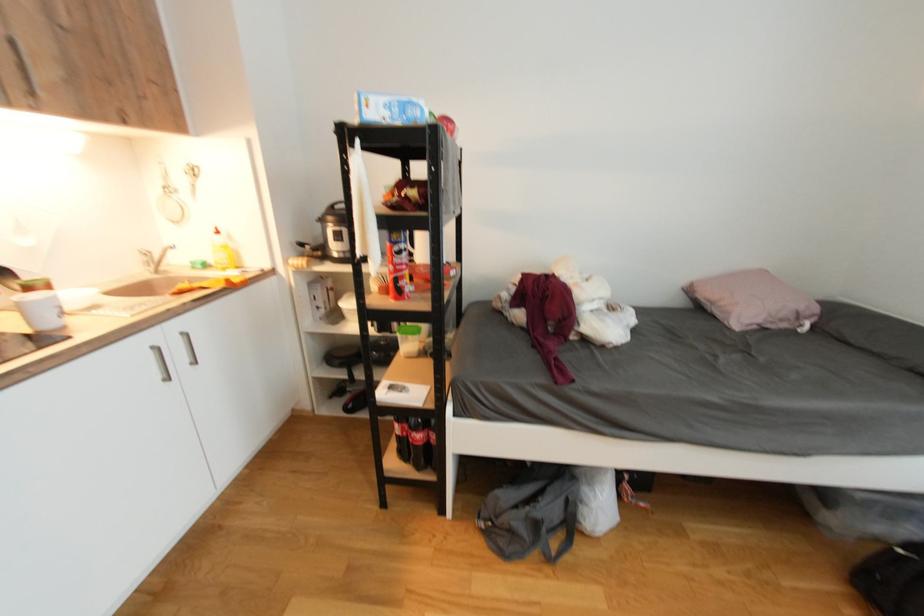
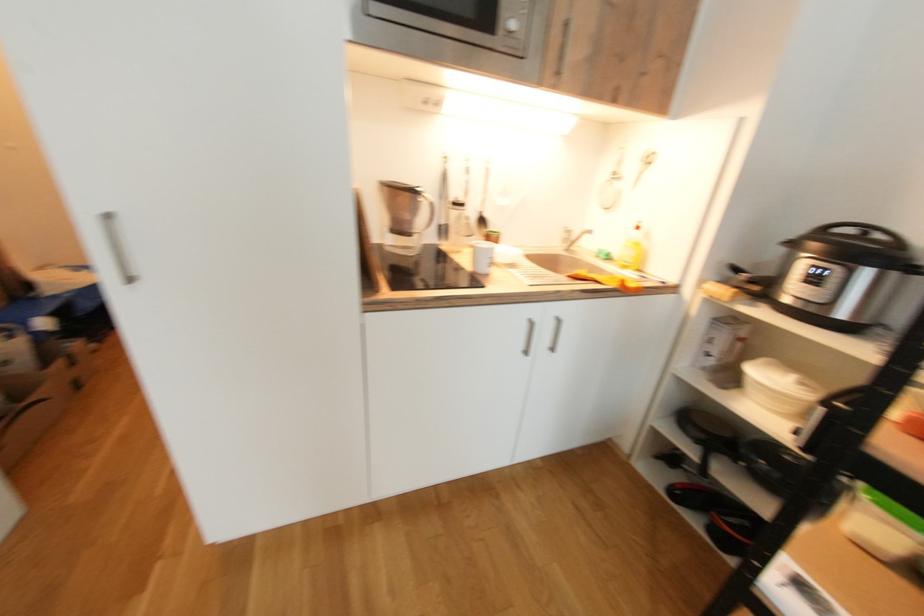
Question: The first image is from the beginning of the video and the second image is from the end. How did the camera likely rotate when shooting the video?

Choices:
 (A) Left
 (B) Right
 (C) Up
 (D) Down

Answer: (A)